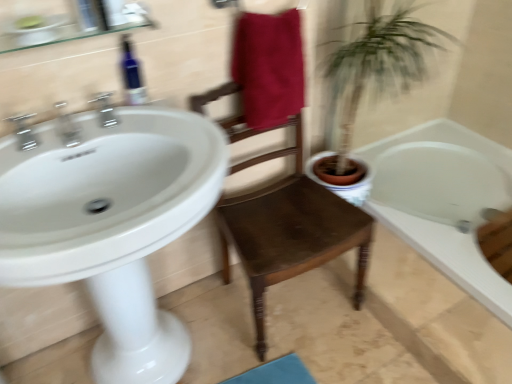
At what (x,y) coordinates should I click in order to perform the action: click on vacant space to the right of chrome metallic faucet at upper left, acting as the 2th tap starting from the left. Please return your answer as a coordinate pair (x, y). The width and height of the screenshot is (512, 384). Looking at the image, I should click on (145, 133).